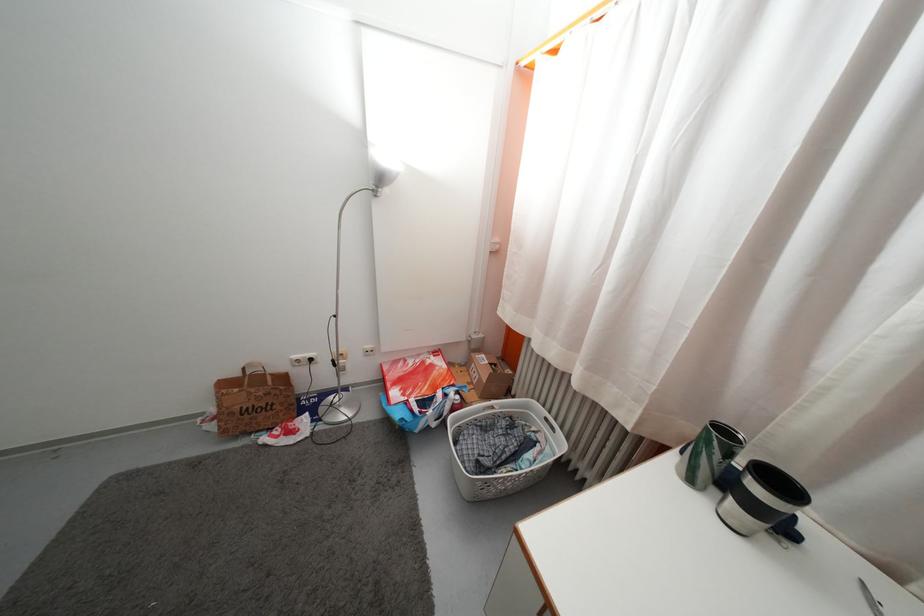
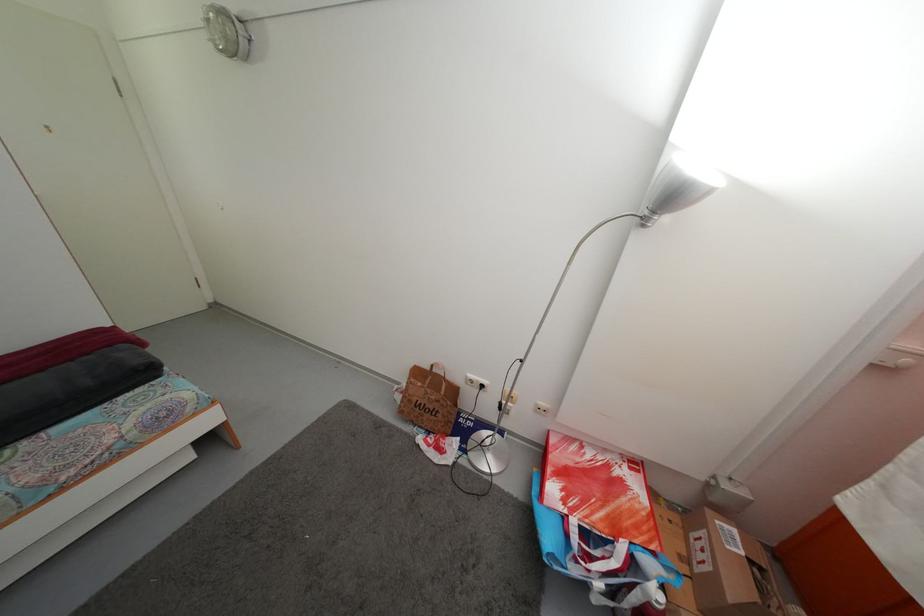
Question: The camera is either moving clockwise (left) or counter-clockwise (right) around the object. The first image is from the beginning of the video and the second image is from the end. Is the camera moving left or right when shooting the video?

Choices:
 (A) Left
 (B) Right

Answer: (B)